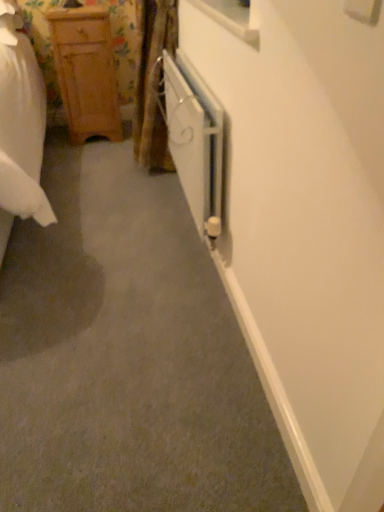
This screenshot has height=512, width=384. What are the coordinates of `white matte radiator at center` in the screenshot? It's located at (195, 140).

Measure the distance between white matte radiator at center and camera.

The depth of white matte radiator at center is 1.39 meters.

What do you see at coordinates (195, 140) in the screenshot? The width and height of the screenshot is (384, 512). I see `white matte radiator at center` at bounding box center [195, 140].

The width and height of the screenshot is (384, 512). Identify the location of wooden cabinet at left. (86, 72).

The width and height of the screenshot is (384, 512). What do you see at coordinates (86, 72) in the screenshot? I see `wooden cabinet at left` at bounding box center [86, 72].

What are the coordinates of `white matte radiator at center` in the screenshot? It's located at (195, 140).

Between wooden cabinet at left and white matte radiator at center, which one appears on the left side from the viewer's perspective?

wooden cabinet at left.

Is wooden cabinet at left in front of or behind white matte radiator at center in the image?

In the image, wooden cabinet at left appears behind white matte radiator at center.

Considering the points (87, 111) and (199, 109), which point is behind, point (87, 111) or point (199, 109)?

The point (87, 111) is more distant.

From the image's perspective, is wooden cabinet at left positioned above or below white matte radiator at center?

Clearly, from the image's perspective, wooden cabinet at left is above white matte radiator at center.

From a real-world perspective, is wooden cabinet at left on white matte radiator at center?

No, from a real-world perspective, wooden cabinet at left is not above white matte radiator at center.

Considering the sizes of objects wooden cabinet at left and white matte radiator at center in the image provided, who is thinner, wooden cabinet at left or white matte radiator at center?

Thinner between the two is white matte radiator at center.

Consider the image. Can you confirm if wooden cabinet at left is shorter than white matte radiator at center?

Incorrect, the height of wooden cabinet at left does not fall short of that of white matte radiator at center.

Based on the photo, between wooden cabinet at left and white matte radiator at center, which one has larger size?

Bigger between the two is wooden cabinet at left.

Is white matte radiator at center a part of wooden cabinet at left?

No, white matte radiator at center is not a part of wooden cabinet at left.

Can you see wooden cabinet at left touching white matte radiator at center?

They are not placed beside each other.

Looking at this image, could you tell me if wooden cabinet at left is turned towards white matte radiator at center?

Yes, wooden cabinet at left faces towards white matte radiator at center.

Identify the location of chest of drawers on the left of white matte radiator at center. The width and height of the screenshot is (384, 512). (86, 72).

Between white matte radiator at center and wooden cabinet at left, which one appears on the left side from the viewer's perspective?

wooden cabinet at left is more to the left.

Is white matte radiator at center positioned behind wooden cabinet at left?

No, the depth of white matte radiator at center is less than that of wooden cabinet at left.

Is point (207, 137) closer or farther from the camera than point (87, 73)?

Point (207, 137) is positioned closer to the camera compared to point (87, 73).

From the image's perspective, is white matte radiator at center above or below wooden cabinet at left?

→ Based on their image positions, white matte radiator at center is located beneath wooden cabinet at left.

From a real-world perspective, is white matte radiator at center above or below wooden cabinet at left?

Clearly, from a real-world perspective, white matte radiator at center is above wooden cabinet at left.

In terms of width, does white matte radiator at center look wider or thinner when compared to wooden cabinet at left?

white matte radiator at center is thinner than wooden cabinet at left.

Considering the relative sizes of white matte radiator at center and wooden cabinet at left in the image provided, is white matte radiator at center shorter than wooden cabinet at left?

Yes.

Who is bigger, white matte radiator at center or wooden cabinet at left?

Bigger between the two is wooden cabinet at left.

Is wooden cabinet at left inside white matte radiator at center?

No, wooden cabinet at left is not a part of white matte radiator at center.

Is white matte radiator at center far away from wooden cabinet at left?

No, white matte radiator at center is not far from wooden cabinet at left.

Is white matte radiator at center looking in the opposite direction of wooden cabinet at left?

white matte radiator at center is not turned away from wooden cabinet at left.

What's the angular difference between white matte radiator at center and wooden cabinet at left's facing directions?

90.6 degrees.

Identify the location of chest of drawers on the left of white matte radiator at center. The height and width of the screenshot is (512, 384). (86, 72).

I want to click on screen door on the right of wooden cabinet at left, so click(x=195, y=140).

Find the location of `chest of drawers on the left of the white matte radiator at center`. chest of drawers on the left of the white matte radiator at center is located at coordinates (86, 72).